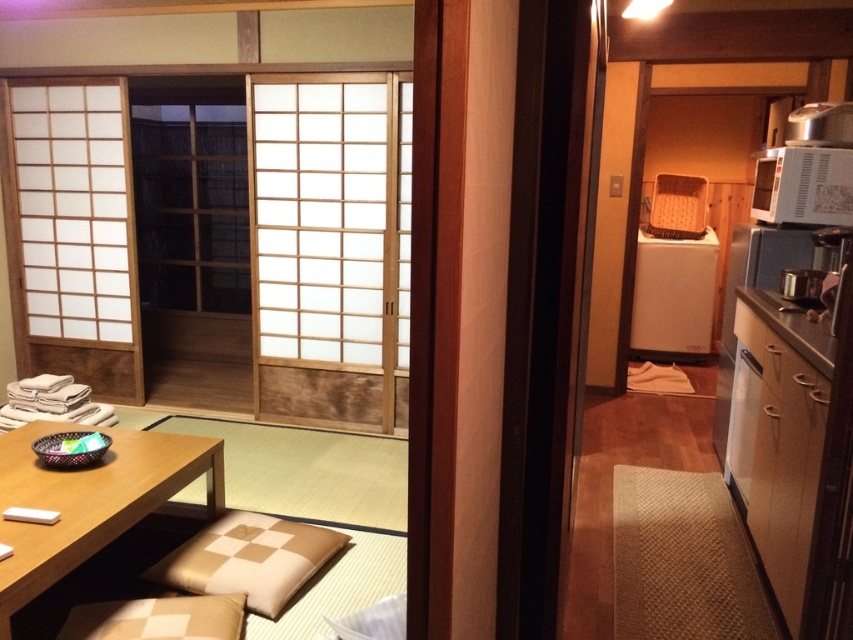
Question: Which point appears closest to the camera in this image?

Choices:
 (A) (194, 470)
 (B) (251, 544)
 (C) (849, 163)

Answer: (B)

Question: From the image, what is the correct spatial relationship of beige checkered pillow at lower center in relation to white matte microwave at upper right?

Choices:
 (A) left
 (B) right

Answer: (A)

Question: Among these objects, which one is nearest to the camera?

Choices:
 (A) white matte microwave at upper right
 (B) beige checkered pillow at lower center
 (C) wooden table at center

Answer: (C)

Question: Where is wooden table at center located in relation to white matte microwave at upper right in the image?

Choices:
 (A) below
 (B) above

Answer: (A)

Question: Can you confirm if wooden table at center is positioned to the right of beige checkered pillow at lower center?

Choices:
 (A) no
 (B) yes

Answer: (A)

Question: Which of these objects is positioned closest to the wooden table at center?

Choices:
 (A) white matte microwave at upper right
 (B) beige checkered pillow at lower center

Answer: (B)